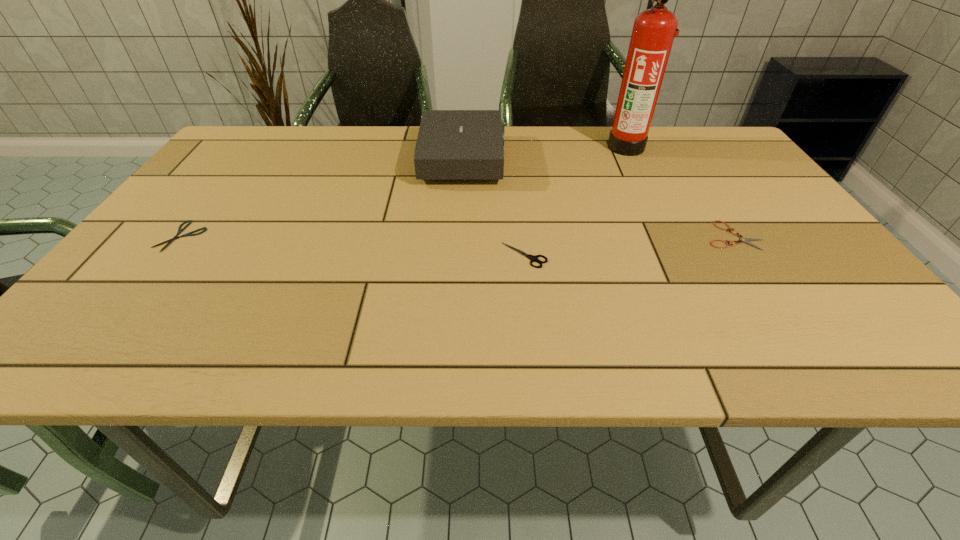
Find the location of `free space that satisfies the following two spatial constraints: 1. on the back side of the rightmost shears; 2. on the front-facing side of the projector`. free space that satisfies the following two spatial constraints: 1. on the back side of the rightmost shears; 2. on the front-facing side of the projector is located at coordinates pos(683,160).

I want to click on vacant position in the image that satisfies the following two spatial constraints: 1. with the nozzle pointing from the back of the tallest object; 2. on the left side of the rightmost shears, so click(x=670, y=235).

Where is `free spot that satisfies the following two spatial constraints: 1. on the front-facing side of the second shears from right to left; 2. on the right side of the fourth shortest object`? The image size is (960, 540). free spot that satisfies the following two spatial constraints: 1. on the front-facing side of the second shears from right to left; 2. on the right side of the fourth shortest object is located at coordinates (458, 255).

Where is `free space that satisfies the following two spatial constraints: 1. on the back side of the rightmost shears; 2. on the front-facing side of the second tallest object`? free space that satisfies the following two spatial constraints: 1. on the back side of the rightmost shears; 2. on the front-facing side of the second tallest object is located at coordinates point(683,160).

I want to click on vacant position in the image that satisfies the following two spatial constraints: 1. with the nozzle pointing from the back of the second object from right to left; 2. on the back side of the rightmost object, so click(x=670, y=235).

Where is `free space that satisfies the following two spatial constraints: 1. on the front-facing side of the projector; 2. on the left side of the rightmost shears`? free space that satisfies the following two spatial constraints: 1. on the front-facing side of the projector; 2. on the left side of the rightmost shears is located at coordinates (459, 235).